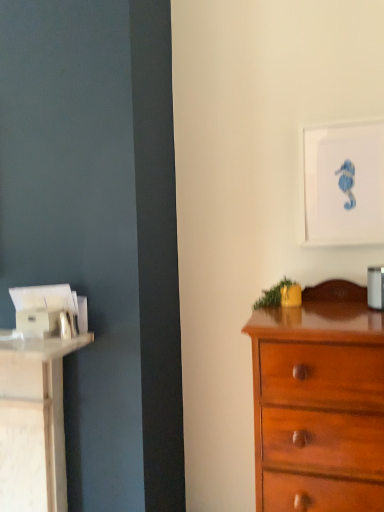
Question: Considering the relative sizes of white matte picture frame at upper right and glossy wood chest of drawers at right in the image provided, is white matte picture frame at upper right thinner than glossy wood chest of drawers at right?

Choices:
 (A) yes
 (B) no

Answer: (A)

Question: Does white matte picture frame at upper right appear on the right side of glossy wood chest of drawers at right?

Choices:
 (A) yes
 (B) no

Answer: (A)

Question: Considering the relative sizes of white matte picture frame at upper right and glossy wood chest of drawers at right in the image provided, is white matte picture frame at upper right smaller than glossy wood chest of drawers at right?

Choices:
 (A) no
 (B) yes

Answer: (B)

Question: Is white matte picture frame at upper right not near glossy wood chest of drawers at right?

Choices:
 (A) no
 (B) yes

Answer: (A)

Question: Is white matte picture frame at upper right touching glossy wood chest of drawers at right?

Choices:
 (A) yes
 (B) no

Answer: (B)

Question: From the image's perspective, does white matte picture frame at upper right appear lower than glossy wood chest of drawers at right?

Choices:
 (A) yes
 (B) no

Answer: (B)

Question: Is the surface of glossy wood chest of drawers at right in direct contact with white matte picture frame at upper right?

Choices:
 (A) no
 (B) yes

Answer: (A)

Question: Considering the relative sizes of glossy wood chest of drawers at right and white matte picture frame at upper right in the image provided, is glossy wood chest of drawers at right bigger than white matte picture frame at upper right?

Choices:
 (A) no
 (B) yes

Answer: (B)

Question: Is glossy wood chest of drawers at right at the right side of white matte picture frame at upper right?

Choices:
 (A) yes
 (B) no

Answer: (B)

Question: Is glossy wood chest of drawers at right far from white matte picture frame at upper right?

Choices:
 (A) yes
 (B) no

Answer: (B)

Question: Does glossy wood chest of drawers at right have a greater height compared to white matte picture frame at upper right?

Choices:
 (A) no
 (B) yes

Answer: (B)

Question: Is white matte picture frame at upper right located within glossy wood chest of drawers at right?

Choices:
 (A) no
 (B) yes

Answer: (A)

Question: From the image's perspective, is glossy wood chest of drawers at right located above or below white matte picture frame at upper right?

Choices:
 (A) below
 (B) above

Answer: (A)